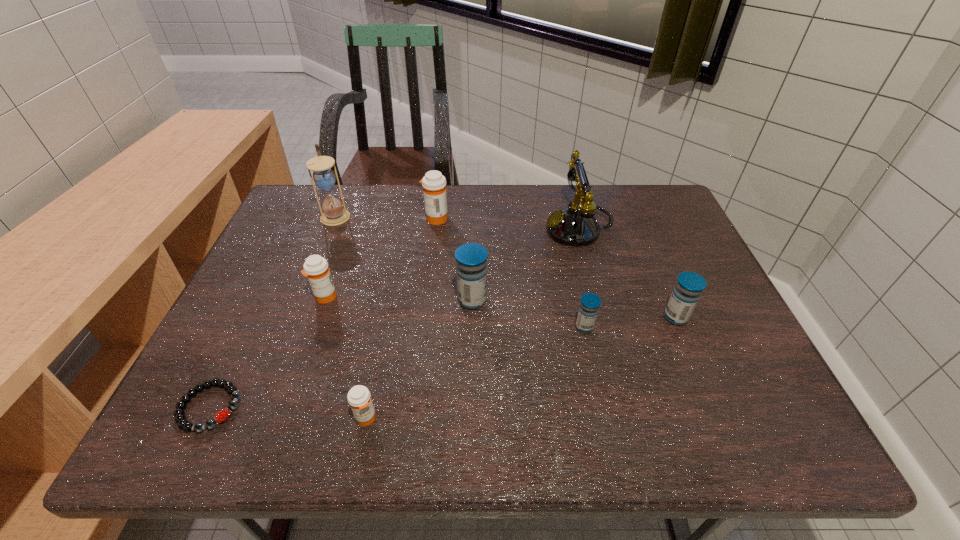
The width and height of the screenshot is (960, 540). I want to click on vacant space at the right edge, so click(666, 244).

I want to click on free point at the far right corner, so click(x=637, y=188).

What are the coordinates of `free space at the near right corner` in the screenshot? It's located at (791, 421).

The width and height of the screenshot is (960, 540). Find the location of `vacant area that lies between the leftmost orange medicine and the bracelet`. vacant area that lies between the leftmost orange medicine and the bracelet is located at coordinates (267, 352).

What are the coordinates of `vacant space in between the second smallest blue medicine and the telephone` in the screenshot? It's located at (628, 273).

Find the location of `free space between the second nearest orange medicine and the hourglass`. free space between the second nearest orange medicine and the hourglass is located at coordinates (330, 256).

You are a GUI agent. You are given a task and a screenshot of the screen. Output one action in this format:
    pyautogui.click(x=<x>, y=<y>)
    Task: Click on the vacant region between the black telephone and the bracelet
    
    Given the screenshot: What is the action you would take?
    tap(395, 318)

The height and width of the screenshot is (540, 960). In order to click on empty space between the white hourglass and the second biggest orange medicine in this screenshot , I will do `click(330, 256)`.

This screenshot has height=540, width=960. What are the coordinates of `unoccupied position between the sixth object from left to right and the second blue medicine from left to right` in the screenshot? It's located at (528, 314).

Locate an element on the screen. This screenshot has width=960, height=540. free area in between the second biggest orange medicine and the biggest blue medicine is located at coordinates (398, 299).